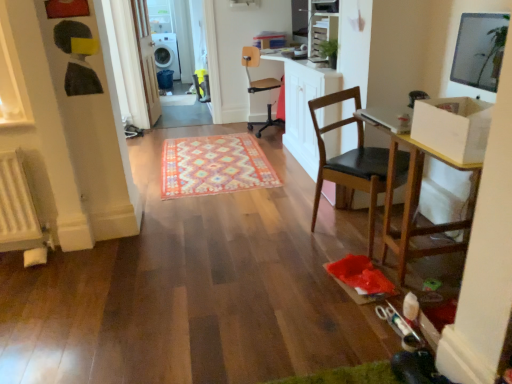
Question: Is white glossy dishwasher at upper left thinner than multicolored woven rug at center?

Choices:
 (A) yes
 (B) no

Answer: (A)

Question: Are white glossy dishwasher at upper left and multicolored woven rug at center located far from each other?

Choices:
 (A) no
 (B) yes

Answer: (B)

Question: Considering the relative sizes of white glossy dishwasher at upper left and multicolored woven rug at center in the image provided, is white glossy dishwasher at upper left smaller than multicolored woven rug at center?

Choices:
 (A) no
 (B) yes

Answer: (A)

Question: Is white glossy dishwasher at upper left facing towards multicolored woven rug at center?

Choices:
 (A) yes
 (B) no

Answer: (A)

Question: Is white glossy dishwasher at upper left closer to the viewer compared to multicolored woven rug at center?

Choices:
 (A) no
 (B) yes

Answer: (A)

Question: From the image's perspective, would you say white glossy dishwasher at upper left is positioned over multicolored woven rug at center?

Choices:
 (A) no
 (B) yes

Answer: (B)

Question: From a real-world perspective, is white matte radiator at lower left below black leather chair at center, which ranks as the 1th chair in bottom-to-top order?

Choices:
 (A) no
 (B) yes

Answer: (B)

Question: Is white matte radiator at lower left looking in the opposite direction of black leather chair at center, acting as the 2th chair starting from the top?

Choices:
 (A) no
 (B) yes

Answer: (A)

Question: Considering the relative sizes of white matte radiator at lower left and black leather chair at center, which is the second chair from back to front, in the image provided, is white matte radiator at lower left wider than black leather chair at center, which is the second chair from back to front,?

Choices:
 (A) no
 (B) yes

Answer: (A)

Question: Does white matte radiator at lower left appear on the left side of black leather chair at center, which is the second chair from back to front?

Choices:
 (A) no
 (B) yes

Answer: (B)

Question: Does white matte radiator at lower left turn towards black leather chair at center, acting as the 2th chair starting from the top?

Choices:
 (A) no
 (B) yes

Answer: (A)

Question: Is the position of white matte radiator at lower left more distant than that of black leather chair at center, marked as the 1th chair in a front-to-back arrangement?

Choices:
 (A) yes
 (B) no

Answer: (A)

Question: From a real-world perspective, is white glossy dishwasher at upper left over black leather chair at center, acting as the 2th chair starting from the top?

Choices:
 (A) yes
 (B) no

Answer: (A)